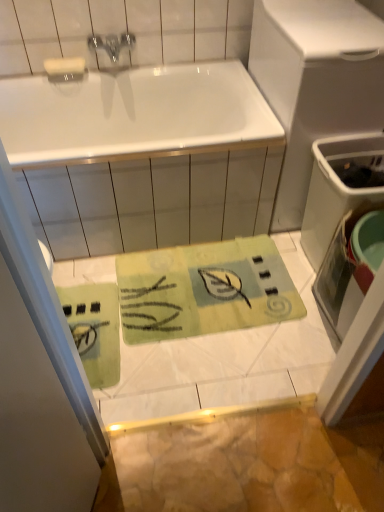
Identify the location of vacant space underneath metallic faucet at upper center (from a real-world perspective). The width and height of the screenshot is (384, 512). (120, 71).